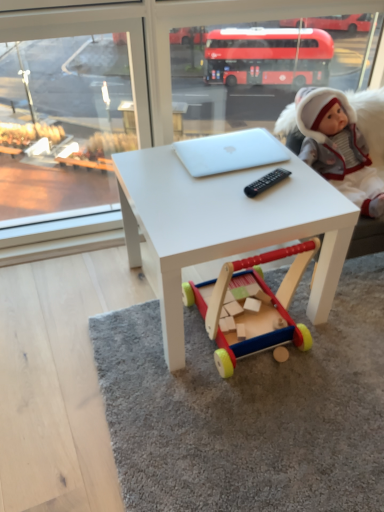
Question: Are white matte laptop at center and white plush doll at upper right beside each other?

Choices:
 (A) yes
 (B) no

Answer: (B)

Question: Is white matte laptop at center at the left side of white plush doll at upper right?

Choices:
 (A) no
 (B) yes

Answer: (B)

Question: Can you confirm if white matte laptop at center is bigger than white plush doll at upper right?

Choices:
 (A) no
 (B) yes

Answer: (A)

Question: Is white matte laptop at center not close to white plush doll at upper right?

Choices:
 (A) yes
 (B) no

Answer: (B)

Question: Could you tell me if white matte laptop at center is turned towards white plush doll at upper right?

Choices:
 (A) no
 (B) yes

Answer: (A)

Question: Looking at the image, does white matte laptop at center seem bigger or smaller compared to wooden toy at center?

Choices:
 (A) small
 (B) big

Answer: (A)

Question: From a real-world perspective, is white matte laptop at center positioned above or below wooden toy at center?

Choices:
 (A) above
 (B) below

Answer: (A)

Question: Does point (203, 163) appear closer or farther from the camera than point (210, 336)?

Choices:
 (A) farther
 (B) closer

Answer: (B)

Question: Visually, is white matte laptop at center positioned to the left or to the right of wooden toy at center?

Choices:
 (A) right
 (B) left

Answer: (B)

Question: From the image's perspective, is white matte table at center positioned above or below white matte laptop at center?

Choices:
 (A) above
 (B) below

Answer: (B)

Question: Visually, is white matte table at center positioned to the left or to the right of white matte laptop at center?

Choices:
 (A) right
 (B) left

Answer: (B)

Question: Relative to white matte laptop at center, is white matte table at center in front or behind?

Choices:
 (A) behind
 (B) front

Answer: (B)

Question: From a real-world perspective, relative to white matte laptop at center, is white matte table at center vertically above or below?

Choices:
 (A) above
 (B) below

Answer: (B)

Question: From the image's perspective, is wooden toy at center positioned above or below white matte laptop at center?

Choices:
 (A) above
 (B) below

Answer: (B)

Question: Is wooden toy at center taller or shorter than white matte laptop at center?

Choices:
 (A) short
 (B) tall

Answer: (B)